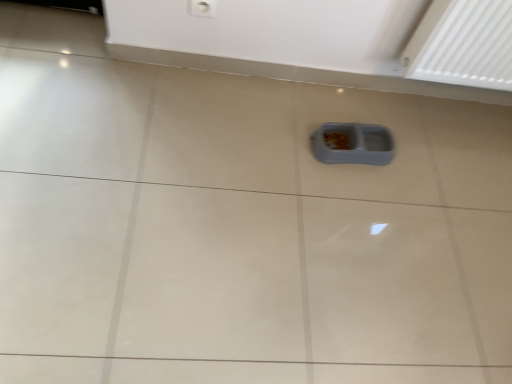
Question: Are gray plastic food container at center and white plastic electric outlet at upper center beside each other?

Choices:
 (A) yes
 (B) no

Answer: (B)

Question: Considering the relative sizes of gray plastic food container at center and white plastic electric outlet at upper center in the image provided, is gray plastic food container at center thinner than white plastic electric outlet at upper center?

Choices:
 (A) no
 (B) yes

Answer: (A)

Question: Can you confirm if gray plastic food container at center is wider than white plastic electric outlet at upper center?

Choices:
 (A) no
 (B) yes

Answer: (B)

Question: Is gray plastic food container at center bigger than white plastic electric outlet at upper center?

Choices:
 (A) no
 (B) yes

Answer: (B)

Question: Is the depth of gray plastic food container at center greater than that of white plastic electric outlet at upper center?

Choices:
 (A) no
 (B) yes

Answer: (B)

Question: From a real-world perspective, is gray plastic food container at center located beneath white plastic electric outlet at upper center?

Choices:
 (A) yes
 (B) no

Answer: (A)

Question: From the image's perspective, is white plastic electric outlet at upper center above gray plastic food container at center?

Choices:
 (A) no
 (B) yes

Answer: (B)

Question: Can you confirm if white plastic electric outlet at upper center is taller than gray plastic food container at center?

Choices:
 (A) no
 (B) yes

Answer: (B)

Question: Is white plastic electric outlet at upper center oriented towards gray plastic food container at center?

Choices:
 (A) yes
 (B) no

Answer: (B)

Question: Does white plastic electric outlet at upper center have a larger size compared to gray plastic food container at center?

Choices:
 (A) yes
 (B) no

Answer: (B)

Question: Can you confirm if white plastic electric outlet at upper center is shorter than gray plastic food container at center?

Choices:
 (A) no
 (B) yes

Answer: (A)

Question: From the image's perspective, is white plastic electric outlet at upper center beneath gray plastic food container at center?

Choices:
 (A) yes
 (B) no

Answer: (B)

Question: In the image, is gray plastic food container at center on the left side or the right side of white plastic electric outlet at upper center?

Choices:
 (A) left
 (B) right

Answer: (B)